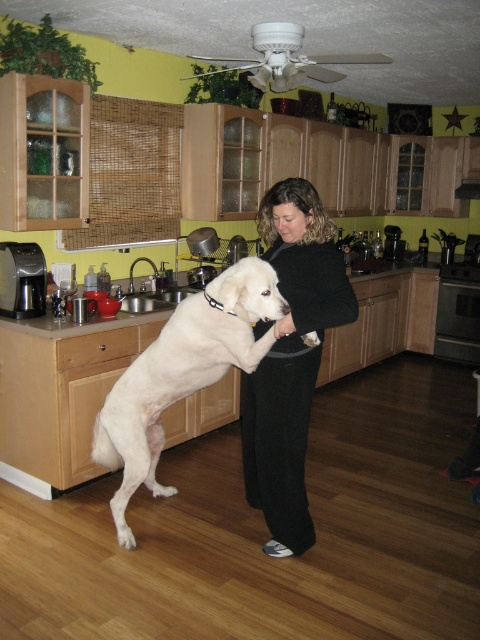
Question: Can you confirm if black soft pants at center is positioned above white fluffy dog at center?

Choices:
 (A) yes
 (B) no

Answer: (A)

Question: Can you confirm if black soft pants at center is wider than white fluffy dog at center?

Choices:
 (A) no
 (B) yes

Answer: (A)

Question: Is the position of black soft pants at center more distant than that of white fluffy dog at center?

Choices:
 (A) yes
 (B) no

Answer: (B)

Question: Which point is closer to the camera?

Choices:
 (A) (264, 419)
 (B) (204, 384)

Answer: (A)